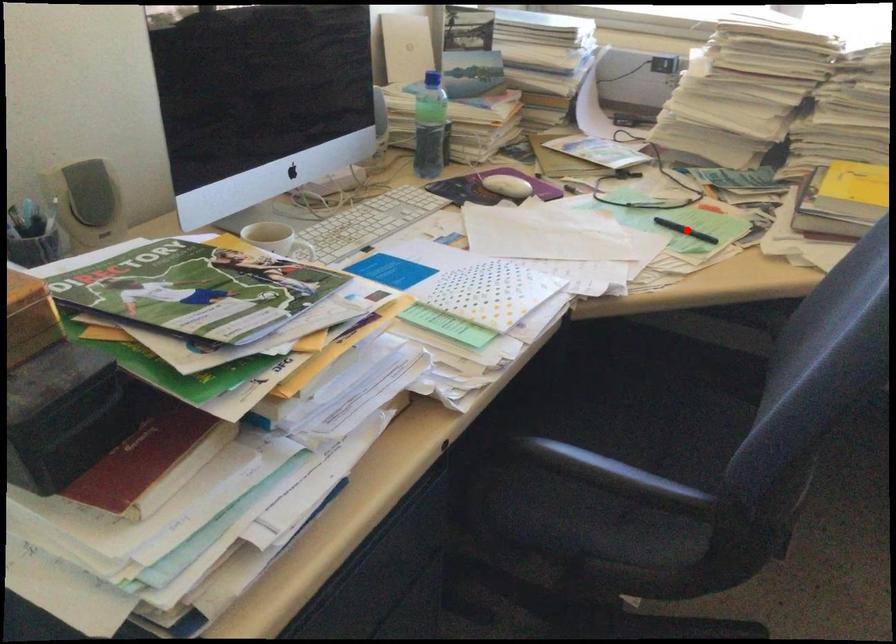
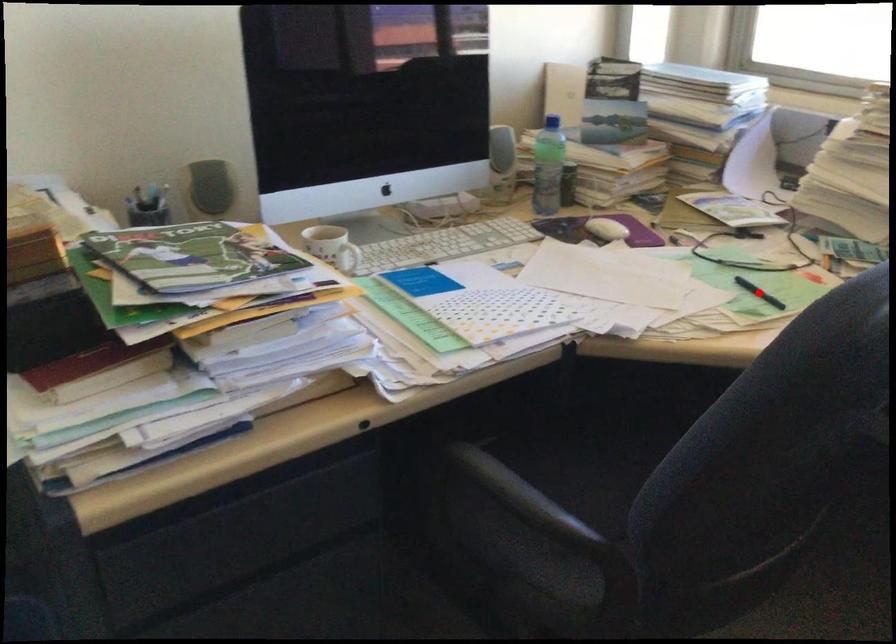
I am providing you with two images of the same scene from different viewpoints. A red point is marked on the first image and another point is marked on the second image. Is the marked point in image1 the same physical position as the marked point in image2?

Yes